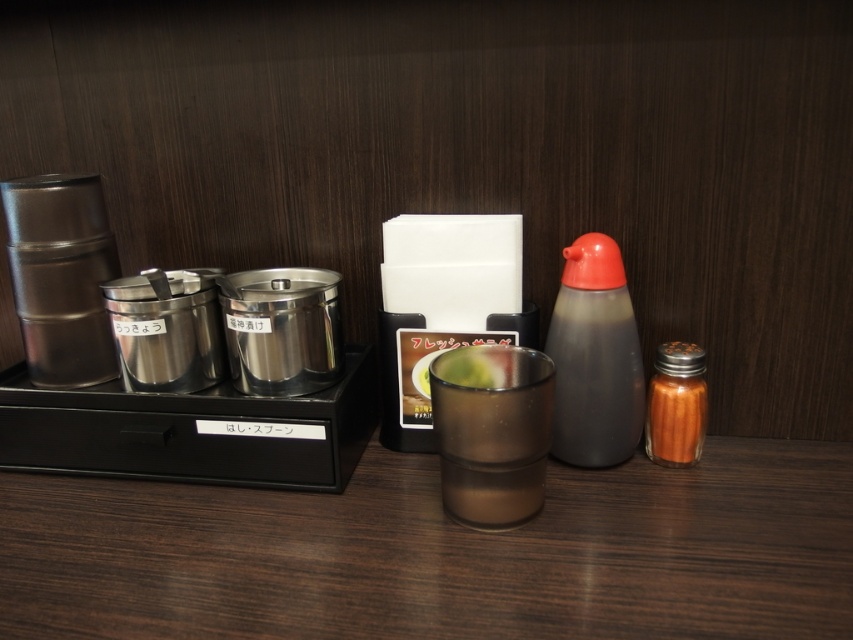
You are a customer at a Japanese restaurant and want to reach both the condiment tray and the napkin holder. The condiment tray is located at point (614, 445) and the napkin holder is at point (648, 424). Which object should you reach for first if you want to touch the one closer to you?

You should reach for the condiment tray at point (614, 445) first because it is closer to you than the napkin holder at point (648, 424), as indicated by their positions in the scene.